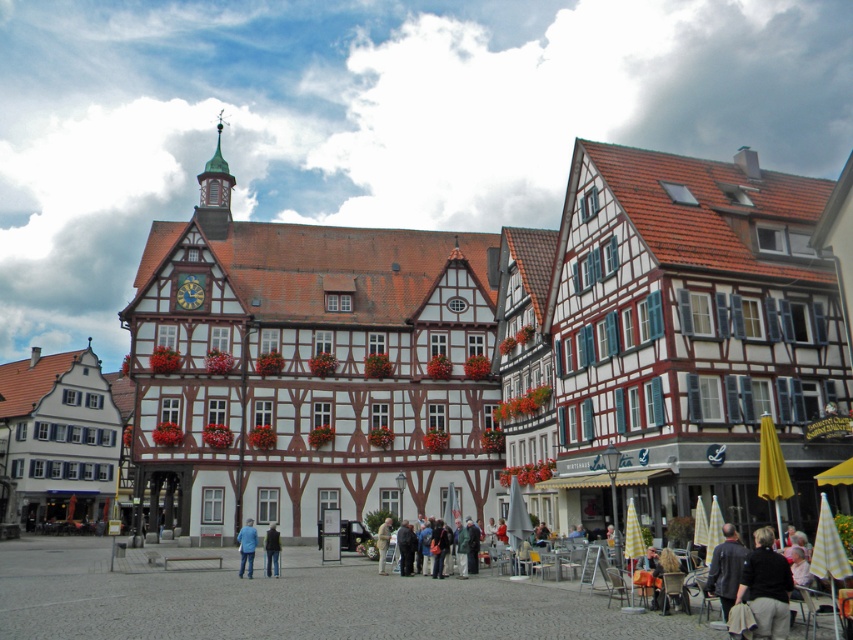
Question: Does dark gray fabric jacket at lower right appear over dark blue jacket at center?

Choices:
 (A) no
 (B) yes

Answer: (B)

Question: Which object is the closest to the dark blue jacket at center?

Choices:
 (A) blue denim jeans at center
 (B) dark gray fabric jacket at lower right

Answer: (A)

Question: Which of the following is the closest to the observer?

Choices:
 (A) dark gray fabric jacket at lower right
 (B) blue denim jeans at center
 (C) dark blue jacket at center

Answer: (A)

Question: Which point is farther to the camera?

Choices:
 (A) dark gray fabric jacket at lower right
 (B) dark blue jacket at center

Answer: (B)

Question: Does blue denim jeans at center appear over dark blue jacket at center?

Choices:
 (A) no
 (B) yes

Answer: (A)

Question: Does dark gray fabric jacket at lower right appear over blue denim jeans at center?

Choices:
 (A) no
 (B) yes

Answer: (B)